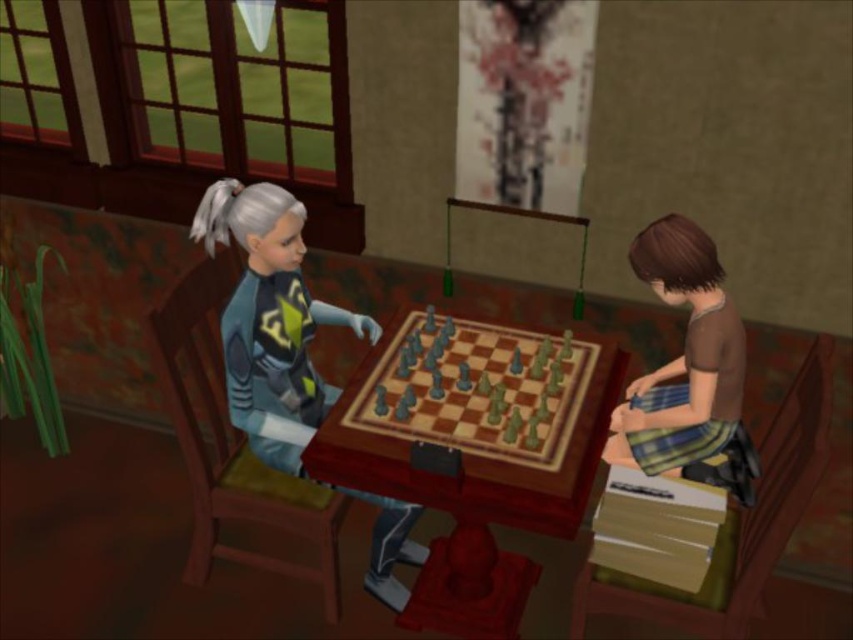
Question: Is wooden chessboard at center above matte blue jacket at center?

Choices:
 (A) no
 (B) yes

Answer: (B)

Question: Is matte blue jacket at center wider than brown fabric shirt at lower right?

Choices:
 (A) no
 (B) yes

Answer: (B)

Question: Where is wooden chessboard at center located in relation to brown fabric shirt at lower right in the image?

Choices:
 (A) above
 (B) below

Answer: (B)

Question: Estimate the real-world distances between objects in this image. Which object is farther from the gray plastic chessboard at center?

Choices:
 (A) matte blue jacket at center
 (B) brown fabric shirt at lower right

Answer: (B)

Question: Among these objects, which one is farthest from the camera?

Choices:
 (A) gray plastic chessboard at center
 (B) brown fabric shirt at lower right
 (C) wooden chessboard at center

Answer: (B)

Question: Which of the following is the closest to the observer?

Choices:
 (A) wooden chessboard at center
 (B) gray plastic chessboard at center
 (C) matte blue jacket at center
 (D) brown fabric shirt at lower right

Answer: (A)